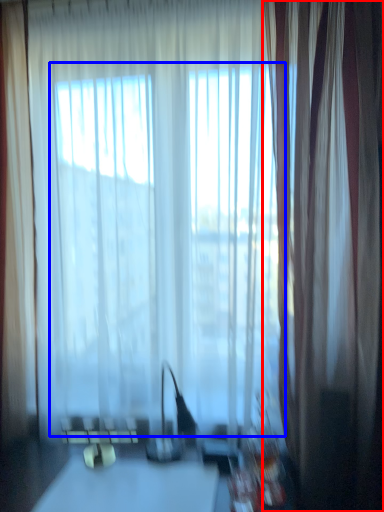
Question: Which object appears closest to the camera in this image, curtain (highlighted by a red box) or bay window (highlighted by a blue box)?

Choices:
 (A) curtain
 (B) bay window

Answer: (A)